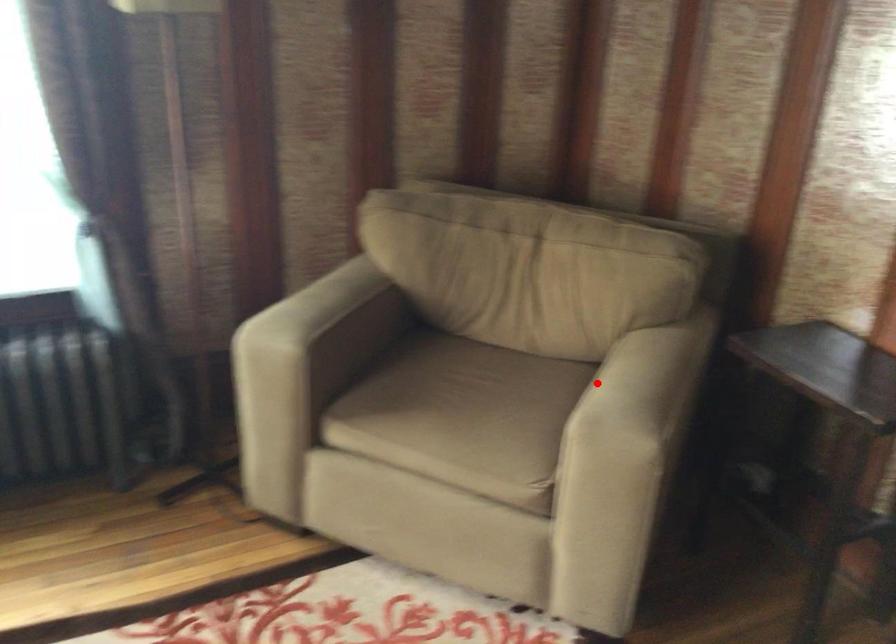
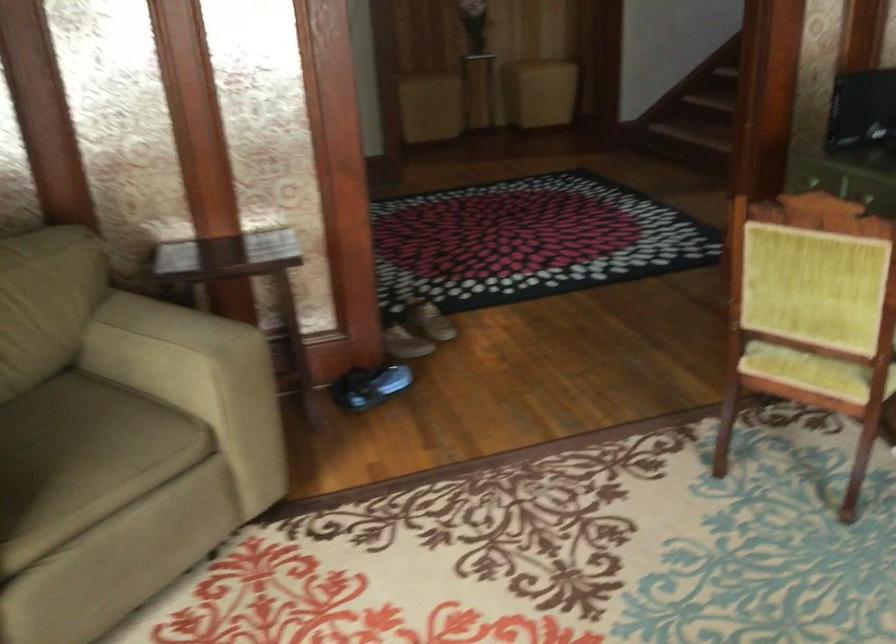
Where in the second image is the point corresponding to the highlighted location from the first image?

(153, 345)